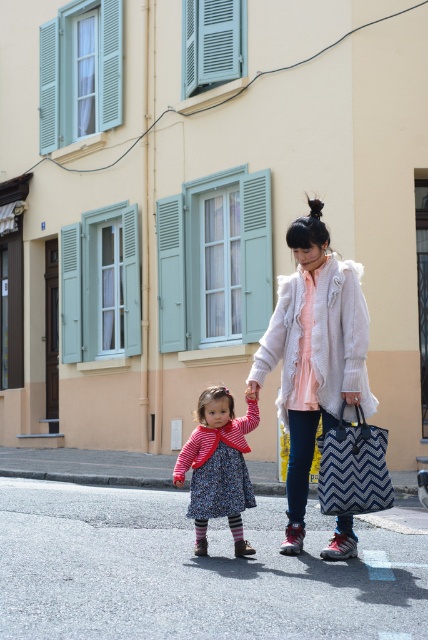
Question: Which point is farther to the camera?

Choices:
 (A) (379, 483)
 (B) (302, 444)
 (C) (228, 408)

Answer: (B)

Question: Which of the following is the closest to the observer?

Choices:
 (A) (240, 444)
 (B) (291, 436)
 (C) (356, 412)

Answer: (C)

Question: Does white fluffy coat at center appear over striped knit dress at center?

Choices:
 (A) no
 (B) yes

Answer: (B)

Question: Does striped knit dress at center have a greater width compared to blue zigzag-patterned fabric bag at center?

Choices:
 (A) yes
 (B) no

Answer: (A)

Question: Estimate the real-world distances between objects in this image. Which object is farther from the blue zigzag-patterned fabric bag at center?

Choices:
 (A) white fluffy coat at center
 (B) striped knit dress at center

Answer: (B)

Question: Does white fluffy coat at center come in front of blue zigzag-patterned fabric bag at center?

Choices:
 (A) no
 (B) yes

Answer: (A)